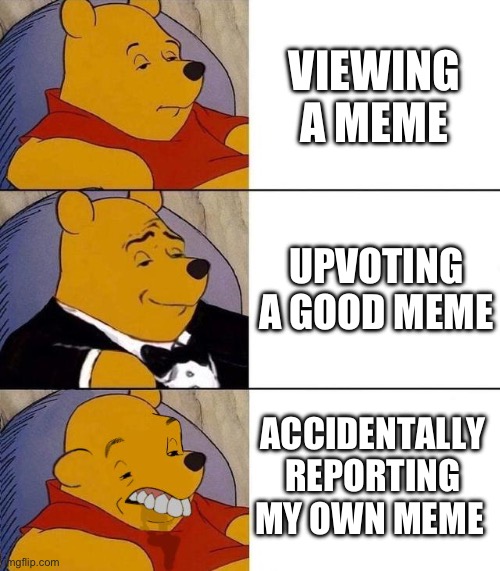
Identify the location of wall. The image size is (500, 571). (224, 36), (0, 14), (224, 235), (0, 197), (0, 403), (232, 403).